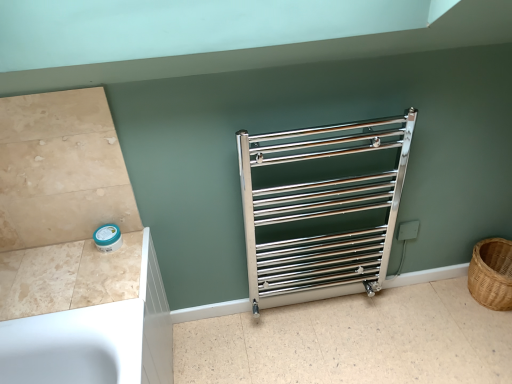
Question: Are polished chrome towel rack at center and brown woven basket at right located far from each other?

Choices:
 (A) no
 (B) yes

Answer: (A)

Question: Does polished chrome towel rack at center have a lesser height compared to brown woven basket at right?

Choices:
 (A) no
 (B) yes

Answer: (A)

Question: Is polished chrome towel rack at center facing towards brown woven basket at right?

Choices:
 (A) no
 (B) yes

Answer: (A)

Question: From the image's perspective, is polished chrome towel rack at center on brown woven basket at right?

Choices:
 (A) no
 (B) yes

Answer: (B)

Question: Considering the relative sizes of polished chrome towel rack at center and brown woven basket at right in the image provided, is polished chrome towel rack at center thinner than brown woven basket at right?

Choices:
 (A) no
 (B) yes

Answer: (B)

Question: Is point (357, 231) positioned closer to the camera than point (480, 339)?

Choices:
 (A) farther
 (B) closer

Answer: (A)

Question: Considering the positions of polished chrome towel rack at center and metallic silver towel rack at center in the image, is polished chrome towel rack at center taller or shorter than metallic silver towel rack at center?

Choices:
 (A) short
 (B) tall

Answer: (B)

Question: Considering their positions, is polished chrome towel rack at center located in front of or behind metallic silver towel rack at center?

Choices:
 (A) front
 (B) behind

Answer: (A)

Question: From the image's perspective, is polished chrome towel rack at center positioned above or below metallic silver towel rack at center?

Choices:
 (A) below
 (B) above

Answer: (B)

Question: Considering the positions of polished chrome towel rack at center and beige marble counter top at lower left in the image, is polished chrome towel rack at center wider or thinner than beige marble counter top at lower left?

Choices:
 (A) wide
 (B) thin

Answer: (B)

Question: From the image's perspective, is polished chrome towel rack at center above or below beige marble counter top at lower left?

Choices:
 (A) above
 (B) below

Answer: (A)

Question: Is polished chrome towel rack at center to the left or to the right of beige marble counter top at lower left in the image?

Choices:
 (A) left
 (B) right

Answer: (B)

Question: Relative to beige marble counter top at lower left, is polished chrome towel rack at center in front or behind?

Choices:
 (A) behind
 (B) front

Answer: (A)

Question: In terms of size, does beige marble counter top at lower left appear bigger or smaller than brown woven basket at right?

Choices:
 (A) big
 (B) small

Answer: (B)

Question: Is point (68, 249) positioned closer to the camera than point (507, 284)?

Choices:
 (A) farther
 (B) closer

Answer: (B)